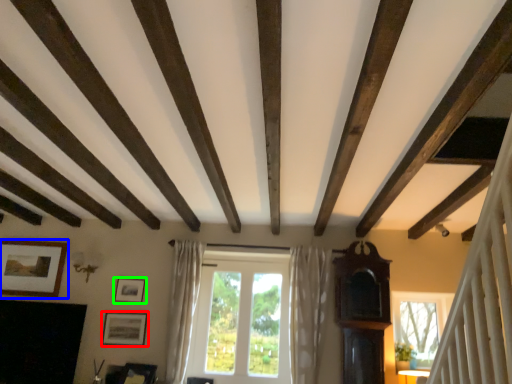
Question: Considering the real-world distances, which object is farthest from picture frame (highlighted by a red box)? picture frame (highlighted by a blue box) or picture frame (highlighted by a green box)?

Choices:
 (A) picture frame
 (B) picture frame

Answer: (A)